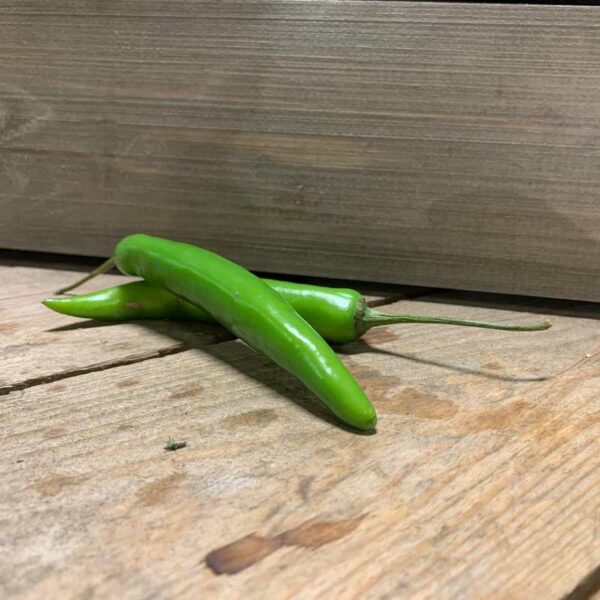
This screenshot has height=600, width=600. What are the coordinates of `brown table` in the screenshot? It's located at (442, 478).